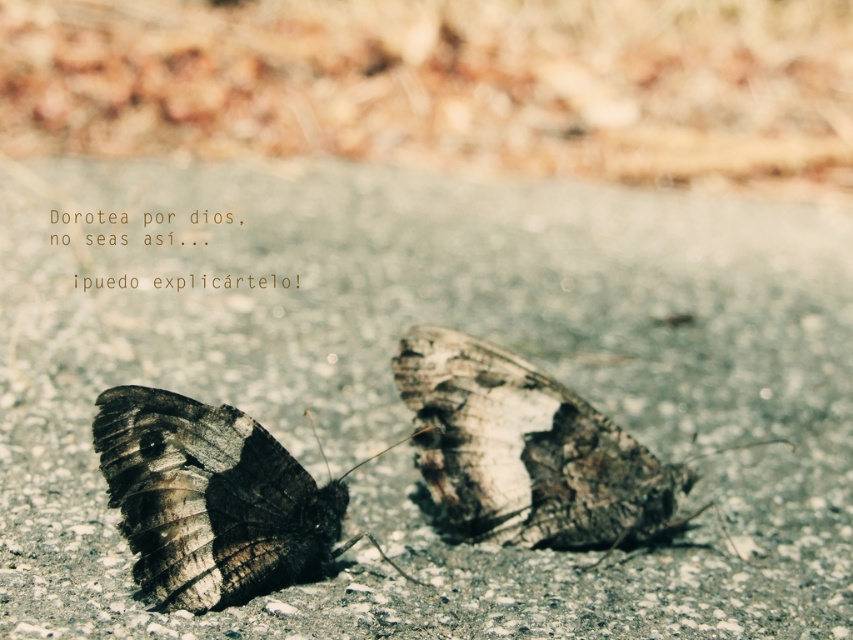
Does brown textured butterfly at center appear over dark brown textured butterfly at lower left?

Correct, brown textured butterfly at center is located above dark brown textured butterfly at lower left.

Which is above, brown textured butterfly at center or dark brown textured butterfly at lower left?

Positioned higher is brown textured butterfly at center.

Where is `brown textured butterfly at center`? brown textured butterfly at center is located at coordinates (525, 451).